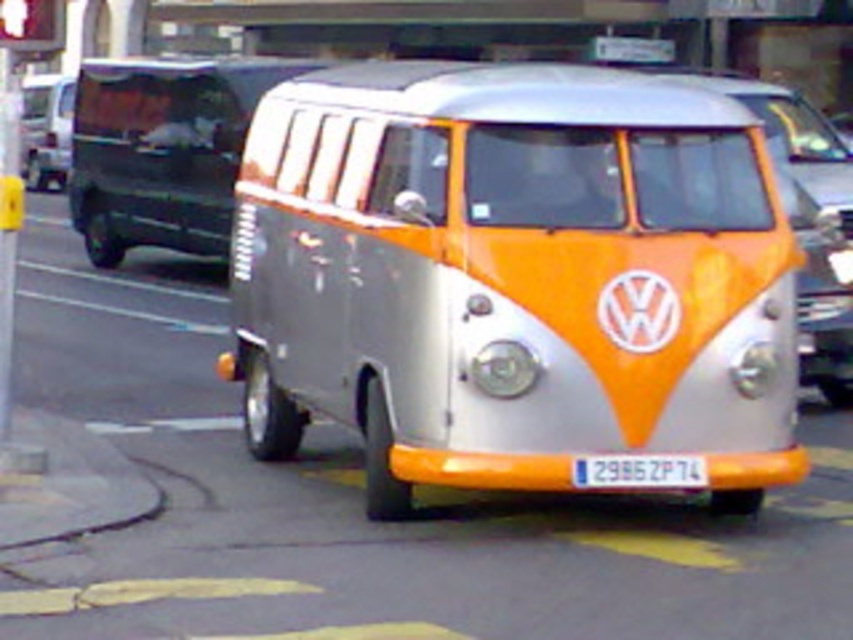
You are a photographer trying to capture the silver metallic van at center and the white plastic license plate at center in a single shot. Since the van is larger, will the license plate be partially hidden by the van?

The silver metallic van at center is larger in size than the white plastic license plate at center, so the license plate might be partially hidden by the van in the photo.

You are a delivery person who needs to deliver a package to the address on the white plastic license plate at center. However, the silver metallic van at center is blocking the license plate. Can you still read the license plate number clearly?

The silver metallic van at center is positioned over white plastic license plate at center, so the van is blocking the license plate. Therefore, the license plate number cannot be read clearly.

You are a delivery driver who needs to check the license plate of the silver metallic van at center. However, you are currently positioned in front of the van. Can you see the white plastic license plate at center from your current position?

The white plastic license plate at center is behind the silver metallic van at center, so you cannot see it from your current position in front of the van.